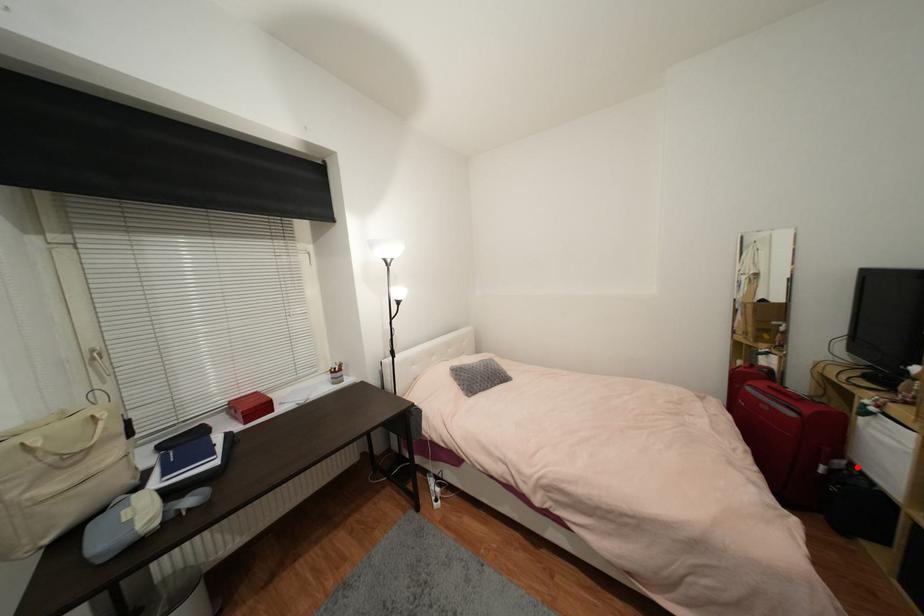
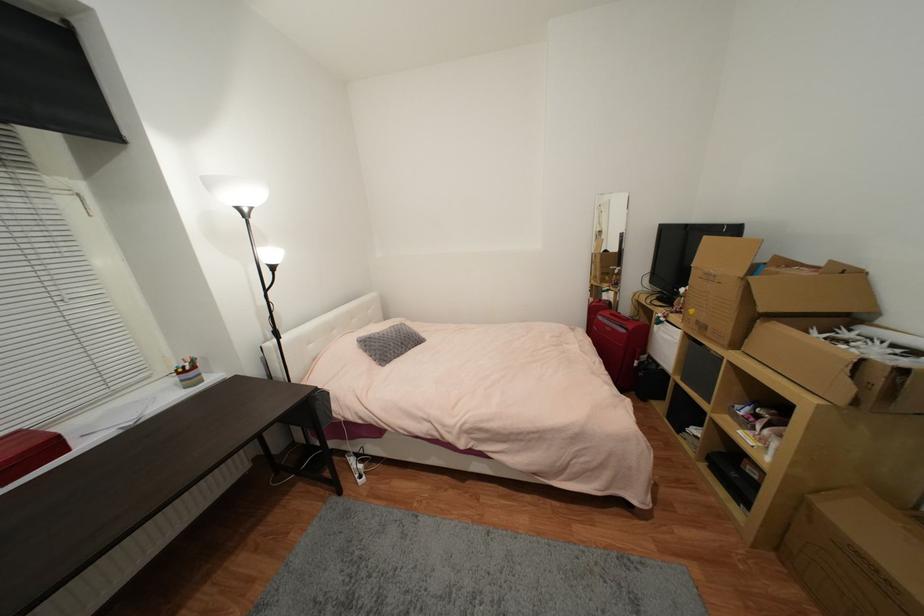
Question: I am providing you with two images of the same scene from different viewpoints. A red point is shown in image1. For the corresponding object point in image2, is it positioned nearer or farther from the camera?

Choices:
 (A) Nearer
 (B) Farther

Answer: (A)